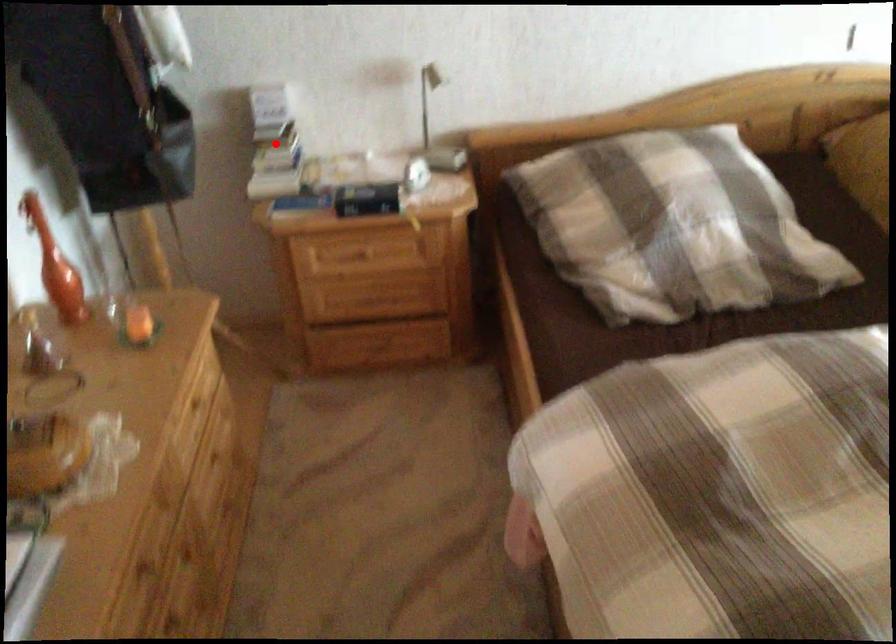
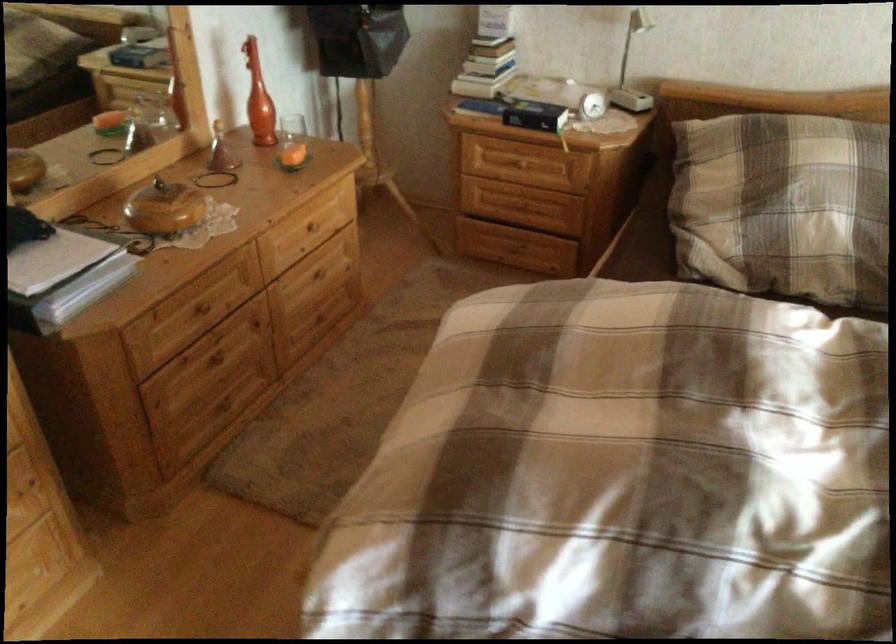
Question: I am providing you with two images of the same scene from different viewpoints. Image1 has a red point marked. In image2, the corresponding 3D location appears at what relative position? Reply with the corresponding letter.

Choices:
 (A) Closer
 (B) Farther

Answer: (B)